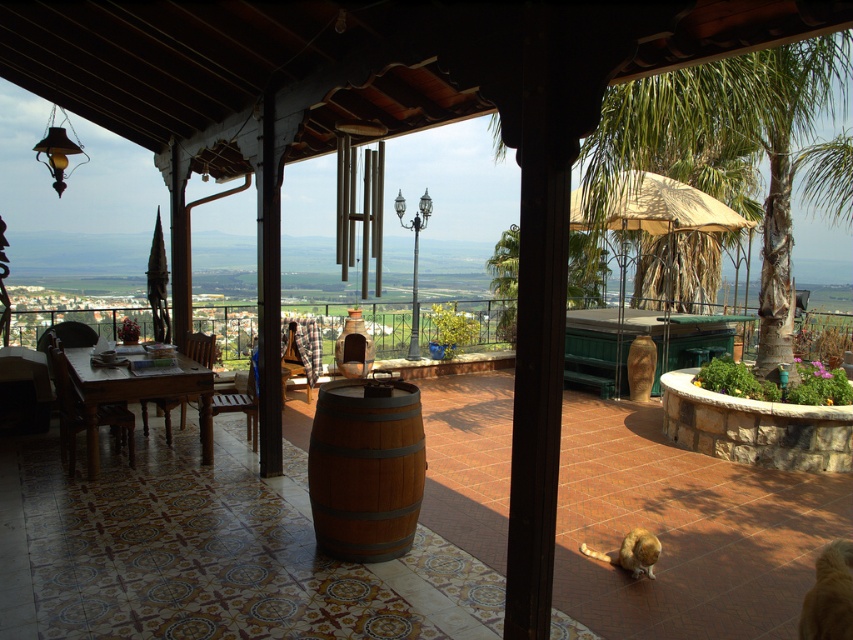
Consider the image. Can you confirm if brown wooden barrel at center is positioned to the left of wooden table at left?

No, brown wooden barrel at center is not to the left of wooden table at left.

What do you see at coordinates (364, 468) in the screenshot? Image resolution: width=853 pixels, height=640 pixels. I see `brown wooden barrel at center` at bounding box center [364, 468].

In order to click on brown wooden barrel at center in this screenshot , I will do `click(364, 468)`.

Is point (749, 170) in front of point (90, 444)?

No, (749, 170) is behind (90, 444).

Between point (721, 150) and point (201, 372), which one is positioned behind?

Positioned behind is point (721, 150).

Find the location of a particular element. This screenshot has width=853, height=640. green leafy palm tree at upper right is located at coordinates (724, 141).

Is green leafy palm tree at upper right to the left of brown wooden barrel at center from the viewer's perspective?

Incorrect, green leafy palm tree at upper right is not on the left side of brown wooden barrel at center.

Does point (704, 168) come behind point (311, 461)?

Yes, point (704, 168) is behind point (311, 461).

Between point (833, 36) and point (364, 445), which one is positioned in front?

Point (364, 445)

Where is `green leafy palm tree at upper right`? green leafy palm tree at upper right is located at coordinates (724, 141).